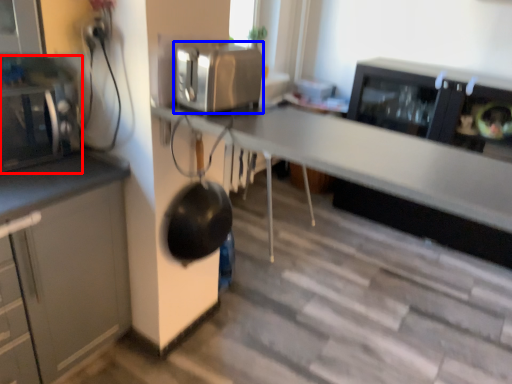
Question: Which point is further to the camera, home appliance (highlighted by a red box) or kitchen appliance (highlighted by a blue box)?

Choices:
 (A) home appliance
 (B) kitchen appliance

Answer: (A)